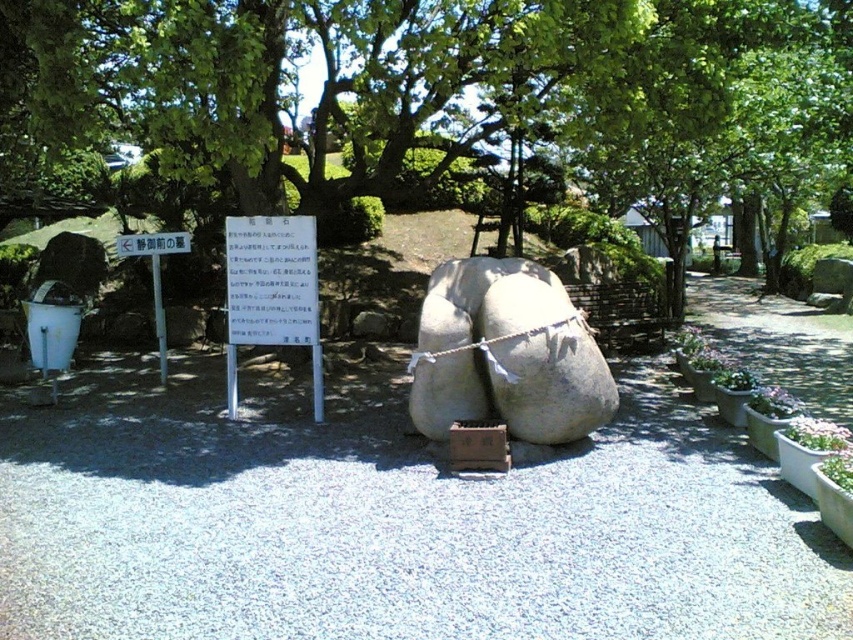
You are standing in the park and see two points marked in the scene. Which point, point (322, 413) or point (165, 248), is closer to you?

Point (322, 413) is closer to the viewer than point (165, 248).

You are walking in the park and see two white paper signs. One is labeled as the white paper sign at center and the other as the white paper sign at upper center. Which one is positioned to the right of the other?

The white paper sign at center is to the right of the white paper sign at upper center.